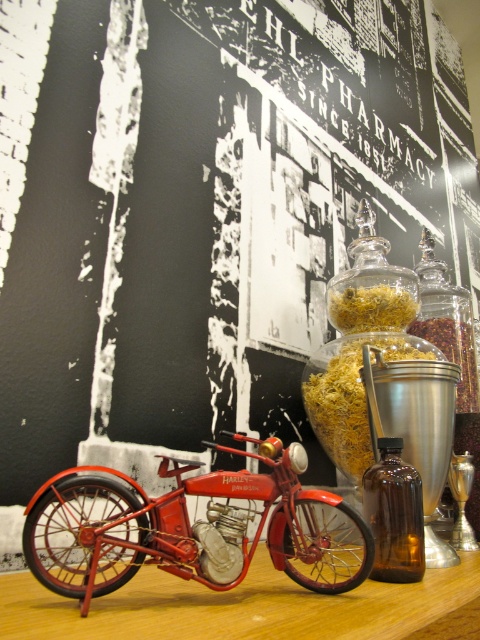
In the scene shown: Does metallic red motorcycle at center have a lesser height compared to yellow shredded food at center?

Incorrect, metallic red motorcycle at center's height does not fall short of yellow shredded food at center's.

Can you confirm if metallic red motorcycle at center is taller than yellow shredded food at center?

Correct, metallic red motorcycle at center is much taller as yellow shredded food at center.

Which is behind, point (236, 522) or point (349, 323)?

The point (349, 323) is more distant.

I want to click on metallic red motorcycle at center, so click(191, 529).

Does translucent glass jar at center appear on the right side of brown glass bottle at right?

Incorrect, translucent glass jar at center is not on the right side of brown glass bottle at right.

Which is below, translucent glass jar at center or brown glass bottle at right?

translucent glass jar at center is below.

Is point (340, 458) farther from camera compared to point (422, 236)?

No, (340, 458) is in front of (422, 236).

Find the location of a particular element. This screenshot has width=480, height=640. translucent glass jar at center is located at coordinates (350, 394).

Is yellow shredded food at center closer to the viewer compared to brown granular spice at center right?

Yes, yellow shredded food at center is closer to the viewer.

Looking at this image, is yellow shredded food at center to the right of brown granular spice at center right from the viewer's perspective?

Incorrect, yellow shredded food at center is not on the right side of brown granular spice at center right.

The width and height of the screenshot is (480, 640). What do you see at coordinates (371, 308) in the screenshot?
I see `yellow shredded food at center` at bounding box center [371, 308].

Image resolution: width=480 pixels, height=640 pixels. Find the location of `yellow shredded food at center`. yellow shredded food at center is located at coordinates (371, 308).